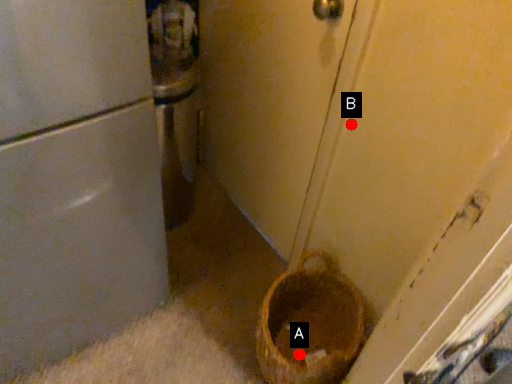
Question: Two points are circled on the image, labeled by A and B beside each circle. Which point is further to the camera?

Choices:
 (A) A is further
 (B) B is further

Answer: (A)